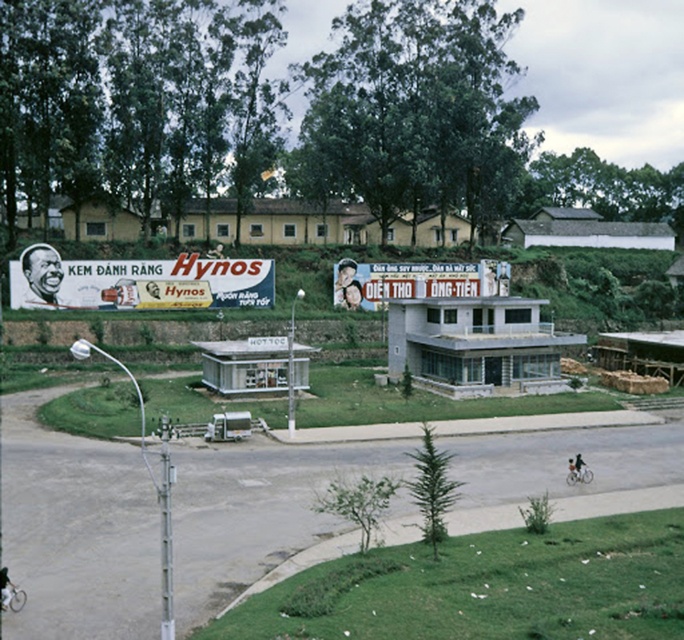
From the picture: Can you confirm if matte yellow billboard at left is thinner than matte plastic billboard at center?

No, matte yellow billboard at left is not thinner than matte plastic billboard at center.

Between point (192, 296) and point (451, 291), which one is positioned behind?

Point (451, 291)

Does point (96, 278) lie in front of point (486, 289)?

Yes, it is.

Identify the location of matte yellow billboard at left. pyautogui.click(x=137, y=282).